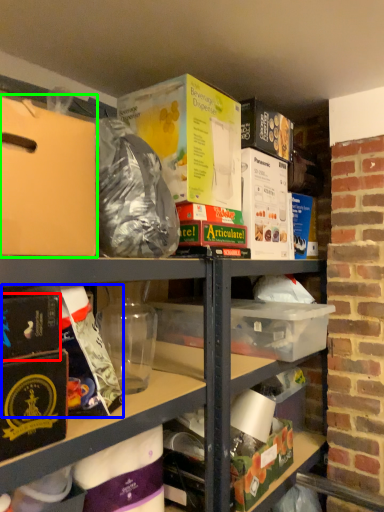
Question: Based on their relative distances, which object is farther from paperback book (highlighted by a red box)? Choose from wrapping paper (highlighted by a blue box) and cardboard box (highlighted by a green box).

Choices:
 (A) wrapping paper
 (B) cardboard box

Answer: (B)